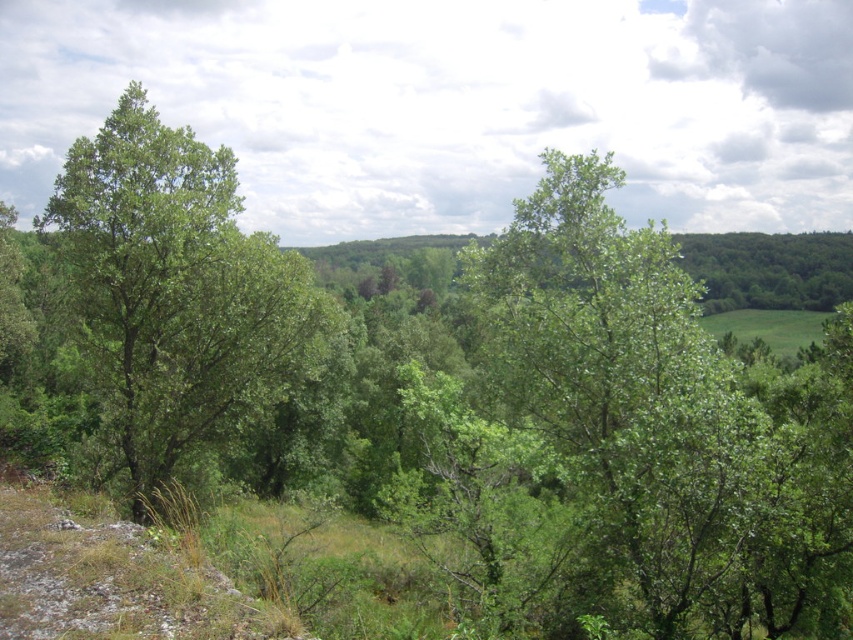
What is the spatial relationship between the green leafy tree at center and the green leafy tree at left?

A: The green leafy tree at center is positioned to the right of the green leafy tree at left.

You are a hiker trying to navigate through the forest. You notice two green leafy trees ahead of you. Which one would you encounter first if you walk straight ahead towards the green leafy tree at center and the green leafy tree at left?

The green leafy tree at center would be encountered first because it is positioned in front of the green leafy tree at left, making it closer to your current position.